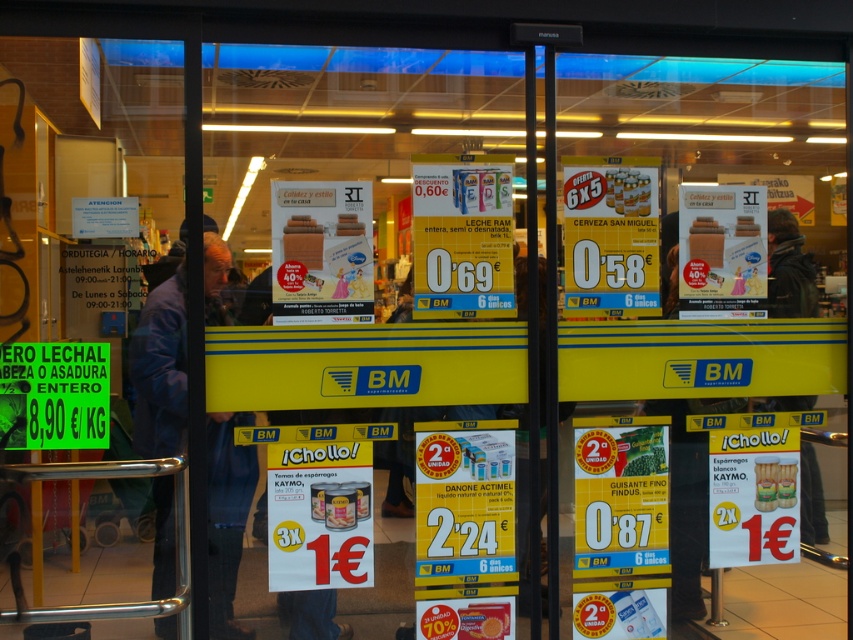
Which is more to the right, dark green jacket at center or matte cardboard beer can at center?

From the viewer's perspective, dark green jacket at center appears more on the right side.

Is dark green jacket at center in front of matte cardboard beer can at center?

That is False.

Where is `dark green jacket at center`? The image size is (853, 640). dark green jacket at center is located at coordinates (788, 268).

Does transparent glass door at left appear on the right side of dark blue jacket at left?

Incorrect, transparent glass door at left is not on the right side of dark blue jacket at left.

Between transparent glass door at left and dark blue jacket at left, which one appears on the right side from the viewer's perspective?

Positioned to the right is dark blue jacket at left.

Identify the location of transparent glass door at left. The height and width of the screenshot is (640, 853). (86, 196).

What are the coordinates of `transparent glass door at left` in the screenshot? It's located at (86, 196).

Based on the photo, measure the distance between transparent glass door at left and matte cardboard beer can at center.

6.13 feet

Who is positioned more to the left, transparent glass door at left or matte cardboard beer can at center?

From the viewer's perspective, transparent glass door at left appears more on the left side.

Between point (79, 248) and point (624, 211), which one is positioned in front?

Point (79, 248)

You are a GUI agent. You are given a task and a screenshot of the screen. Output one action in this format:
    pyautogui.click(x=<x>, y=<y>)
    Task: Click on the transparent glass door at left
    This screenshot has height=640, width=853.
    Given the screenshot: What is the action you would take?
    pyautogui.click(x=86, y=196)